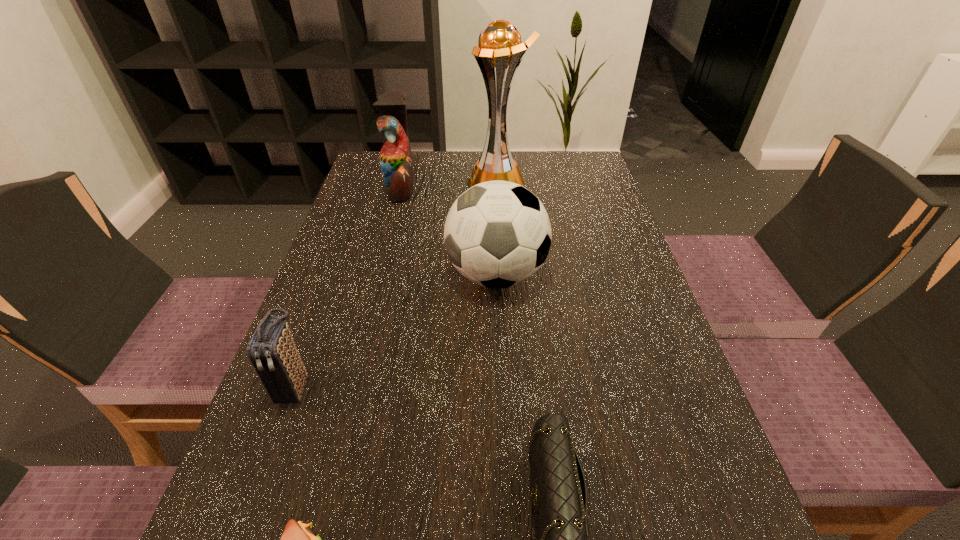
This screenshot has width=960, height=540. Find the location of `free spot located 0.170m on the main logo of the soccer ball`. free spot located 0.170m on the main logo of the soccer ball is located at coordinates (372, 275).

Locate an element on the screen. This screenshot has width=960, height=540. vacant area situated on the main logo of the soccer ball is located at coordinates (385, 275).

This screenshot has width=960, height=540. Identify the location of vacant area located 0.050m with the zip open on the left clutch bag. (276, 441).

What are the coordinates of `trophy present at the far edge` in the screenshot? It's located at (500, 45).

Identify the location of parrot present at the far edge. point(396,164).

At what (x,y) coordinates should I click in order to perform the action: click on parrot situated at the left edge. Please return your answer as a coordinate pair (x, y). The height and width of the screenshot is (540, 960). Looking at the image, I should click on (396, 164).

Where is `clutch bag positioned at the left edge`? clutch bag positioned at the left edge is located at coordinates (272, 351).

This screenshot has width=960, height=540. I want to click on object that is at the far left corner, so click(x=396, y=164).

This screenshot has width=960, height=540. In the image, there is a desktop. In order to click on vacant region at the far edge in this screenshot , I will do coord(434,153).

Find the location of `free space at the left edge of the desktop`. free space at the left edge of the desktop is located at coordinates (301, 520).